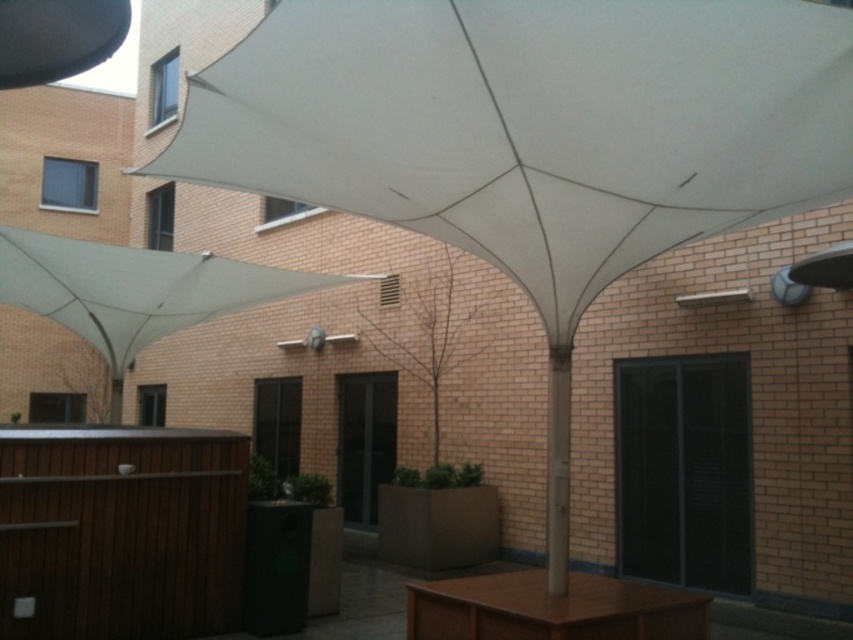
Question: Which object is farther from the camera taking this photo?

Choices:
 (A) brown wooden table at center
 (B) white fabric canopy at center

Answer: (A)

Question: Observing the image, what is the correct spatial positioning of white fabric canopy at center in reference to brown wooden table at center?

Choices:
 (A) above
 (B) below

Answer: (A)

Question: Does white fabric canopy at center have a larger size compared to brown wooden table at center?

Choices:
 (A) yes
 (B) no

Answer: (A)

Question: Is white fabric canopy at center bigger than brown wooden table at center?

Choices:
 (A) yes
 (B) no

Answer: (A)